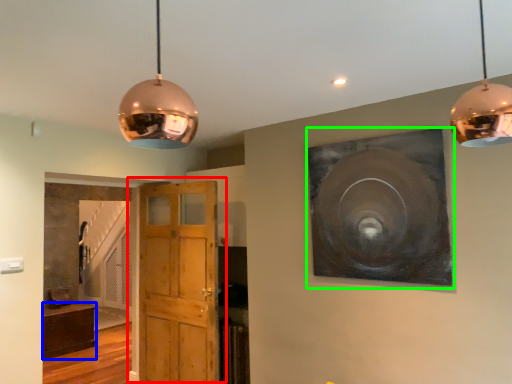
Question: Which is nearer to the door (highlighted by a red box)? cabinetry (highlighted by a blue box) or picture frame (highlighted by a green box).

Choices:
 (A) cabinetry
 (B) picture frame

Answer: (B)